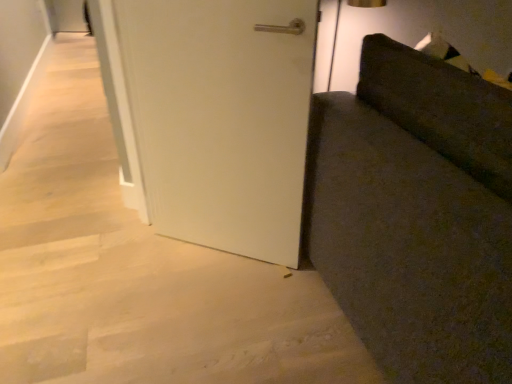
I want to click on free space in front of white matte door at center, so tap(236, 309).